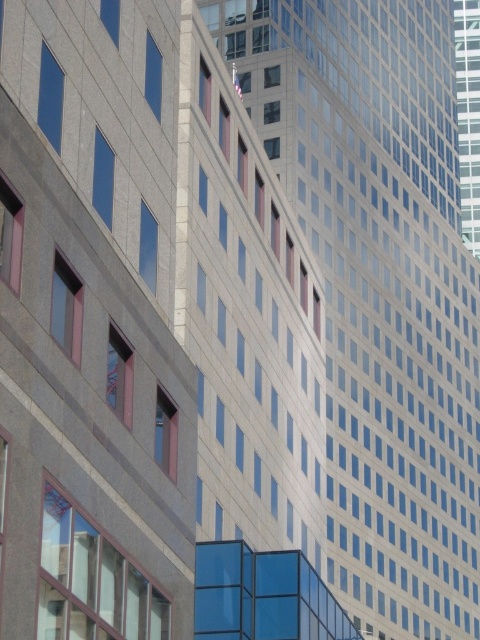
Question: Where is smooth glass skyscraper at center located in relation to glassy reflective skyscraper at upper right in the image?

Choices:
 (A) left
 (B) right

Answer: (A)

Question: Can you confirm if smooth glass skyscraper at center is thinner than glassy reflective skyscraper at upper right?

Choices:
 (A) yes
 (B) no

Answer: (B)

Question: Is smooth glass skyscraper at center thinner than glassy reflective skyscraper at upper right?

Choices:
 (A) no
 (B) yes

Answer: (A)